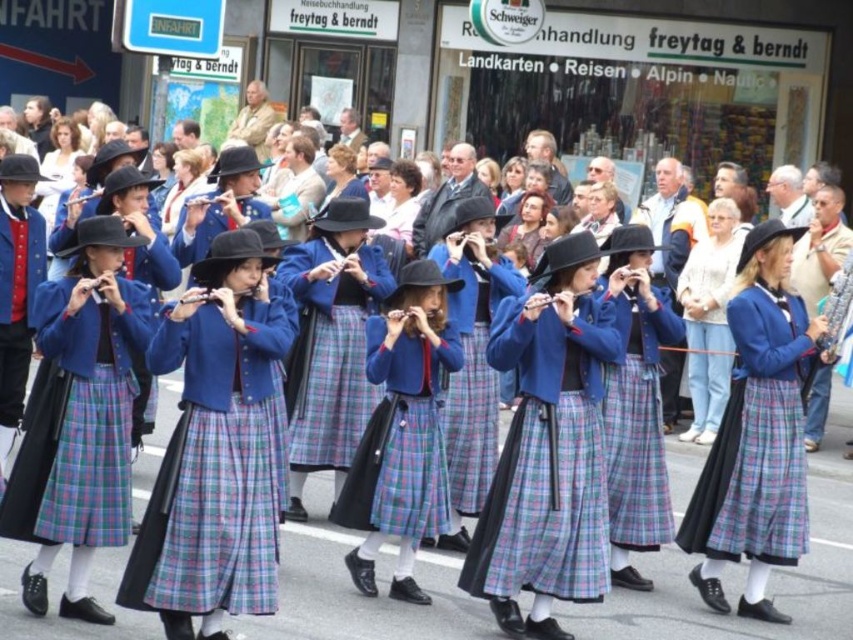
How distant is matte blue jacket at center from plaid wool skirt at center?

They are 7.40 feet apart.

Which is more to the left, matte blue jacket at center or plaid wool skirt at center?

matte blue jacket at center is more to the left.

Who is more distant from viewer, [445,321] or [766,513]?

The point [445,321] is more distant.

You are a GUI agent. You are given a task and a screenshot of the screen. Output one action in this format:
    pyautogui.click(x=<x>, y=<y>)
    Task: Click on the matte blue jacket at center
    
    Given the screenshot: What is the action you would take?
    pyautogui.click(x=402, y=432)